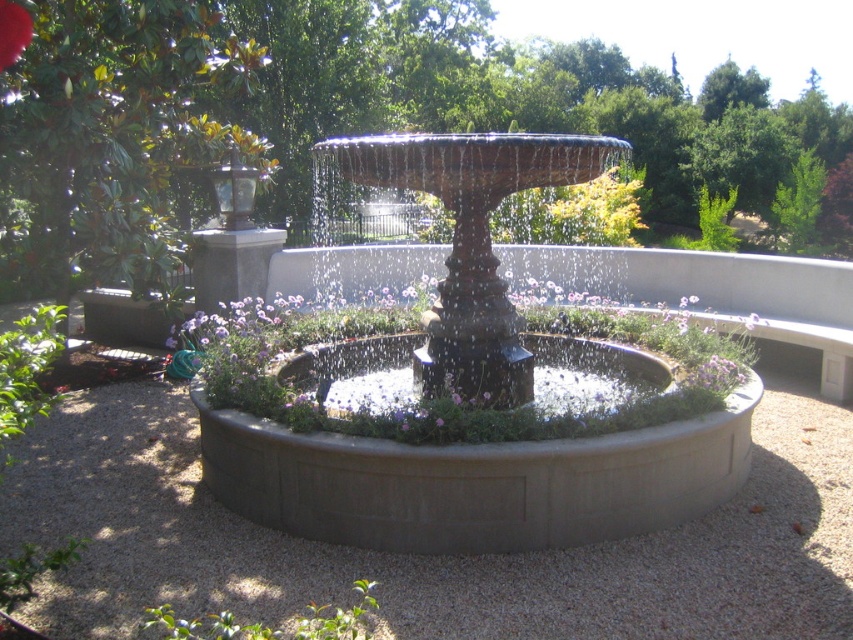
Can you confirm if dark brown stone fountain at center is positioned below red matte flower at center?

Correct, dark brown stone fountain at center is located below red matte flower at center.

Can you confirm if dark brown stone fountain at center is positioned above red matte flower at center?

No.

The height and width of the screenshot is (640, 853). Find the location of `dark brown stone fountain at center`. dark brown stone fountain at center is located at coordinates (468, 392).

At what (x,y) coordinates should I click in order to perform the action: click on dark brown stone fountain at center. Please return your answer as a coordinate pair (x, y). The image size is (853, 640). Looking at the image, I should click on (468, 392).

Is the position of dark brown stone fountain at center more distant than that of purple matte flower at center?

No, it is not.

Which of these two, dark brown stone fountain at center or purple matte flower at center, stands taller?

Standing taller between the two is dark brown stone fountain at center.

This screenshot has height=640, width=853. Find the location of `dark brown stone fountain at center`. dark brown stone fountain at center is located at coordinates (468, 392).

Can you confirm if gray gravel at center is positioned to the left of purple matte flower at center?

Indeed, gray gravel at center is positioned on the left side of purple matte flower at center.

Is gray gravel at center positioned at the back of purple matte flower at center?

No.

Between point (695, 580) and point (714, 390), which one is positioned behind?

The point (714, 390) is more distant.

This screenshot has height=640, width=853. I want to click on gray gravel at center, so click(424, 556).